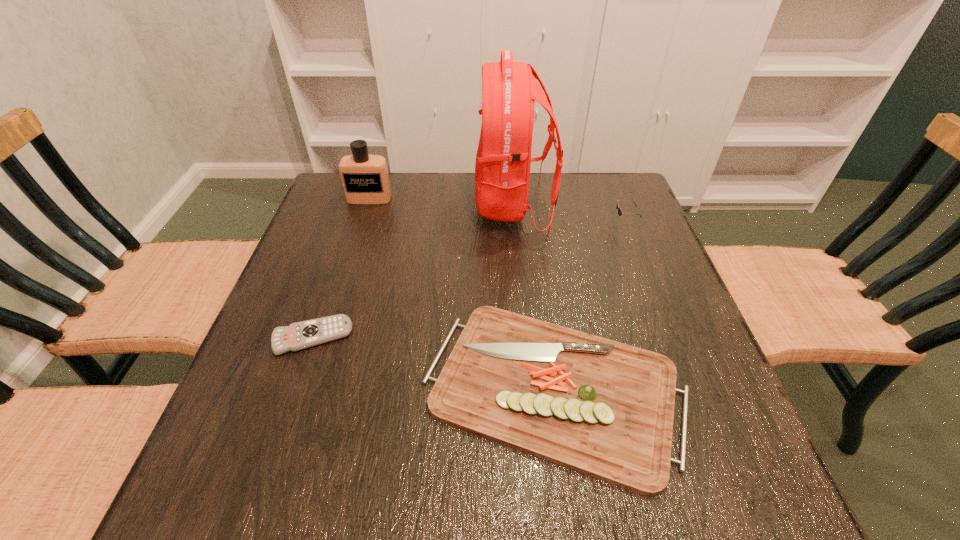
Where is `vacant space at the near right corner of the desktop`? vacant space at the near right corner of the desktop is located at coordinates (701, 482).

Identify the location of empty space between the chopping board and the tallest object. The image size is (960, 540). (534, 297).

Image resolution: width=960 pixels, height=540 pixels. In order to click on free spot between the backpack and the perfume in this screenshot , I will do (x=441, y=202).

At what (x,y) coordinates should I click in order to perform the action: click on unoccupied position between the fourth shortest object and the shortest object. Please return your answer as a coordinate pair (x, y). The width and height of the screenshot is (960, 540). Looking at the image, I should click on (341, 268).

The height and width of the screenshot is (540, 960). I want to click on vacant space in between the fourth tallest object and the backpack, so click(534, 297).

Identify the location of free space between the perfume and the second shortest object. (462, 293).

I want to click on free space between the tallest object and the perfume, so click(441, 202).

Find the location of a particular element. This screenshot has height=540, width=960. free spot between the chopping board and the sunglasses is located at coordinates (589, 305).

In order to click on object that is the fourth closest to the chopping board in this screenshot , I will do `click(365, 180)`.

Locate which object ranks fourth in proximity to the sunglasses. Please provide its 2D coordinates. Your answer should be formatted as a tuple, i.e. [(x, y)], where the tuple contains the x and y coordinates of a point satisfying the conditions above.

[(297, 336)]